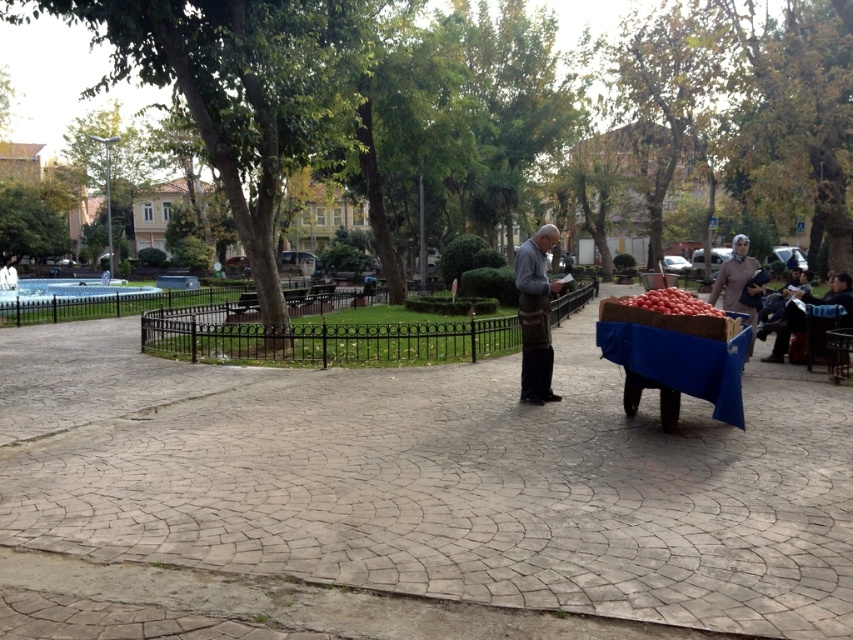
Which of these two, blue fabric cart at right or red matte tomatoes at right, stands taller?

With more height is blue fabric cart at right.

Between point (653, 349) and point (660, 310), which one is positioned behind?

The point (660, 310) is behind.

The width and height of the screenshot is (853, 640). I want to click on blue fabric cart at right, so click(x=682, y=362).

Is brown woolen coat at center behind red matte tomatoes at right?

That is True.

Does brown woolen coat at center appear on the left side of red matte tomatoes at right?

Indeed, brown woolen coat at center is positioned on the left side of red matte tomatoes at right.

What do you see at coordinates (535, 316) in the screenshot? I see `brown woolen coat at center` at bounding box center [535, 316].

Where is `brown woolen coat at center`? The width and height of the screenshot is (853, 640). brown woolen coat at center is located at coordinates (535, 316).

Does blue fabric cart at right appear over brown woolen coat at center?

No.

What are the coordinates of `blue fabric cart at right` in the screenshot? It's located at (682, 362).

Find the location of a particular element. The height and width of the screenshot is (640, 853). blue fabric cart at right is located at coordinates (682, 362).